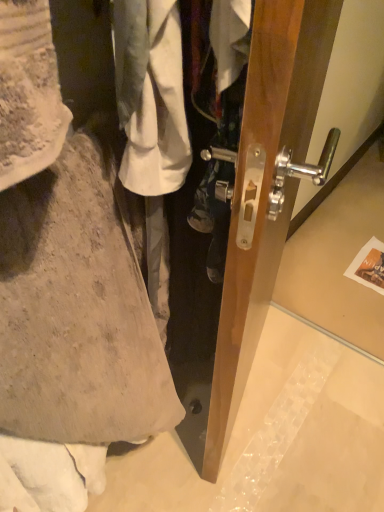
The image size is (384, 512). Describe the element at coordinates (267, 188) in the screenshot. I see `wooden door handle at center` at that location.

Based on the photo, what is the approximate height of wooden door handle at center?

It is 1.22 meters.

Find the location of a particular element. The image size is (384, 512). wooden door handle at center is located at coordinates (267, 188).

Where is `wooden door handle at center`? wooden door handle at center is located at coordinates (267, 188).